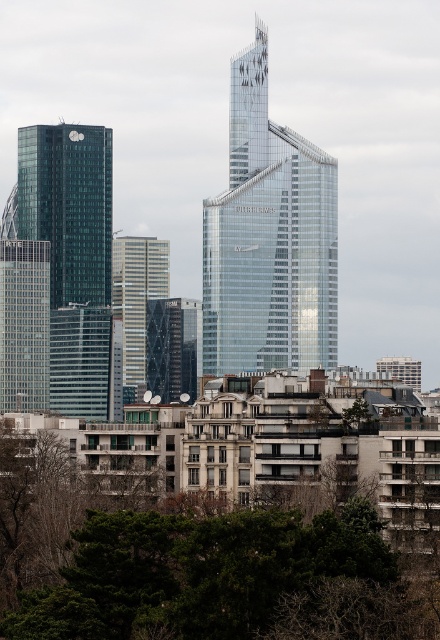
Is transparent glass skyscraper at center wider than metallic glass tower at center?

Yes.

Is transparent glass skyscraper at center further to the viewer compared to metallic glass tower at center?

That is False.

Does point (219, 232) come closer to viewer compared to point (156, 292)?

That is False.

Where is `transparent glass skyscraper at center`? The image size is (440, 640). transparent glass skyscraper at center is located at coordinates (268, 240).

Is the position of transparent glass skyscraper at center less distant than that of shiny glass skyscraper at left?

Yes, it is in front of shiny glass skyscraper at left.

Is transparent glass skyscraper at center wider than shiny glass skyscraper at left?

Yes, transparent glass skyscraper at center is wider than shiny glass skyscraper at left.

Is point (268, 312) behind point (105, 384)?

No, (268, 312) is closer to viewer.

Locate an element on the screen. The width and height of the screenshot is (440, 640). transparent glass skyscraper at center is located at coordinates (268, 240).

Which of these two, shiny glass skyscraper at left or metallic glass tower at center, stands shorter?

With less height is metallic glass tower at center.

Based on the photo, is shiny glass skyscraper at left positioned at the back of metallic glass tower at center?

Yes, shiny glass skyscraper at left is further from the viewer.

Where is `shiny glass skyscraper at left`? The image size is (440, 640). shiny glass skyscraper at left is located at coordinates (73, 253).